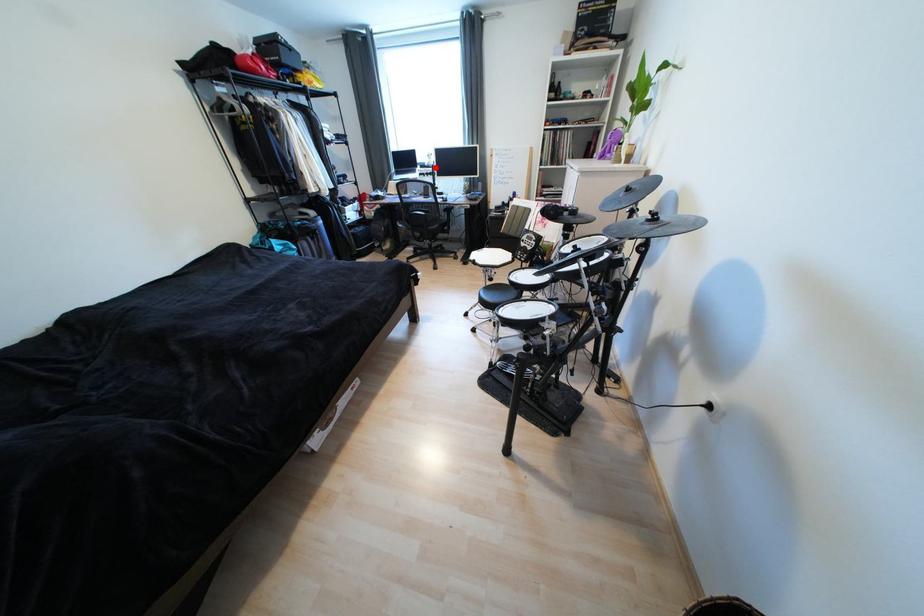
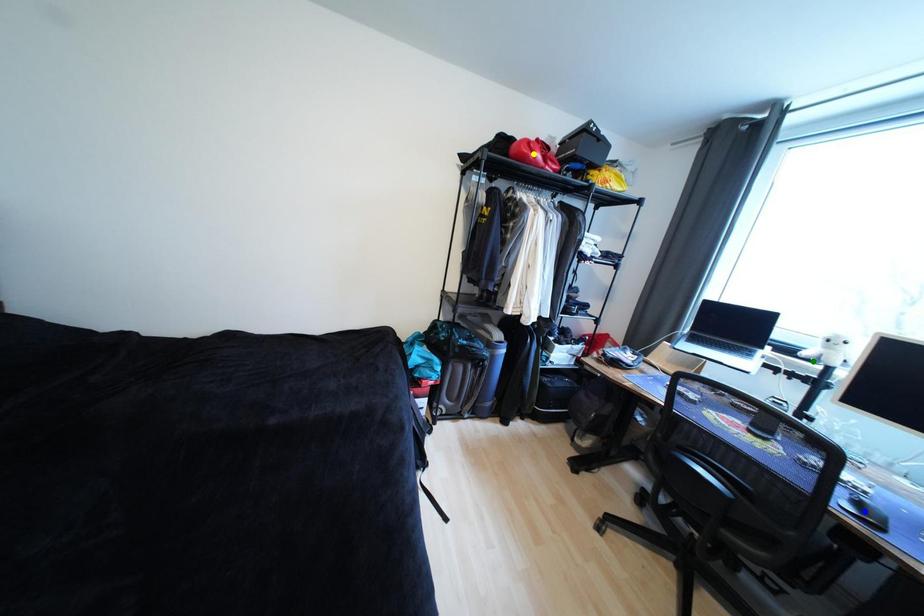
Question: I am providing you with two images of the same scene from different viewpoints. A red point is marked on the first image. You are given multiple points on the second image. In image 2, which mark is for the same physical point as the one in image 1?

Choices:
 (A) yellow point
 (B) blue point
 (C) green point

Answer: (C)